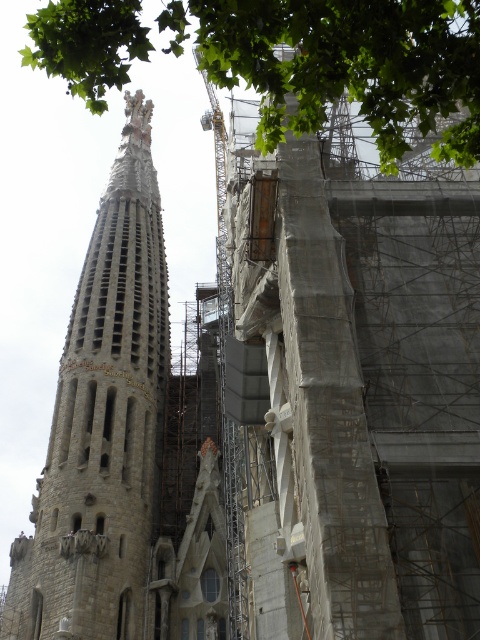
Between stone tower at left and green leafy tree at upper center, which one is positioned lower?

stone tower at left is lower down.

Can you confirm if stone tower at left is positioned to the right of green leafy tree at upper center?

In fact, stone tower at left is to the left of green leafy tree at upper center.

Is point (121, 193) positioned after point (333, 1)?

Yes, point (121, 193) is farther from viewer.

The height and width of the screenshot is (640, 480). In order to click on stone tower at left in this screenshot , I will do `click(103, 422)`.